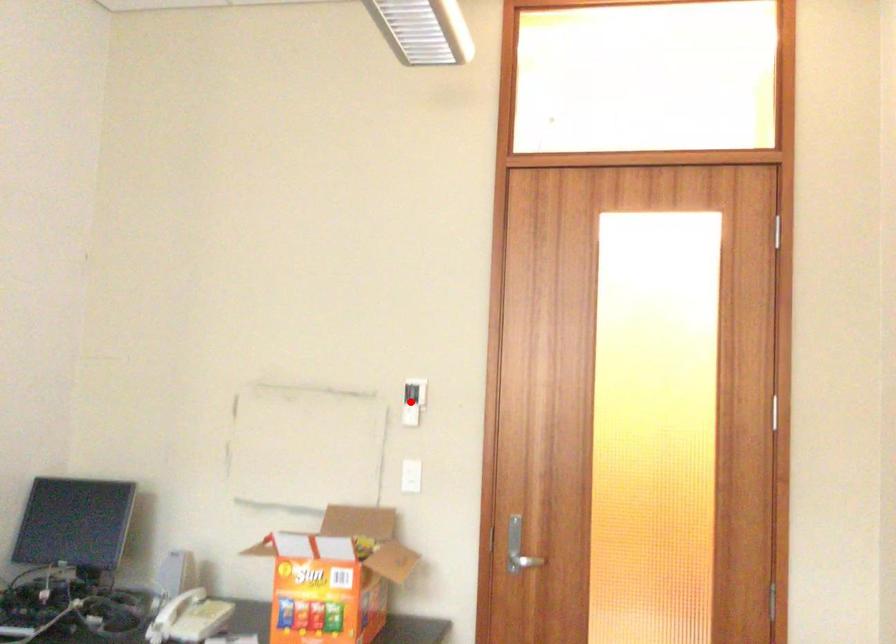
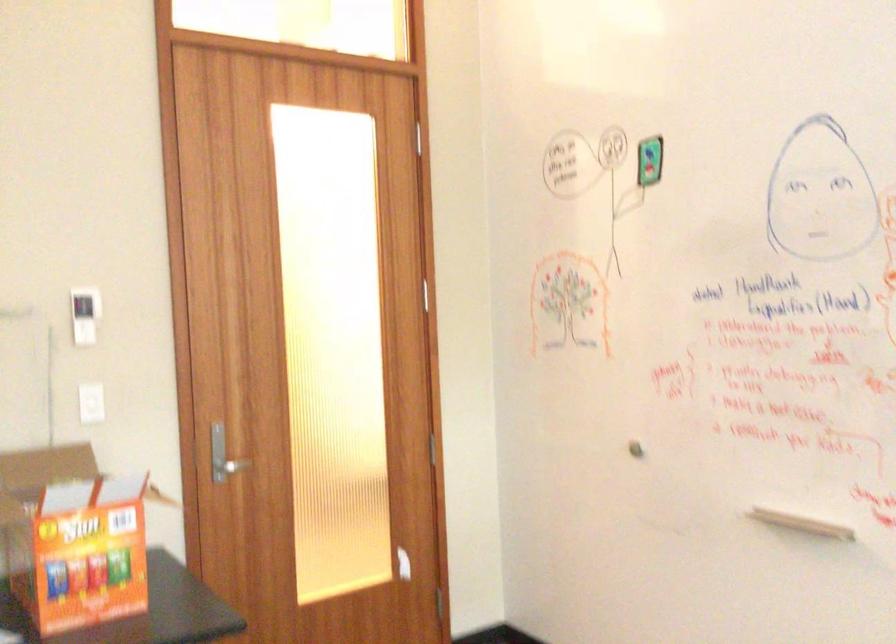
Locate, in the second image, the point that corresponds to the highlighted location in the first image.

(84, 315)